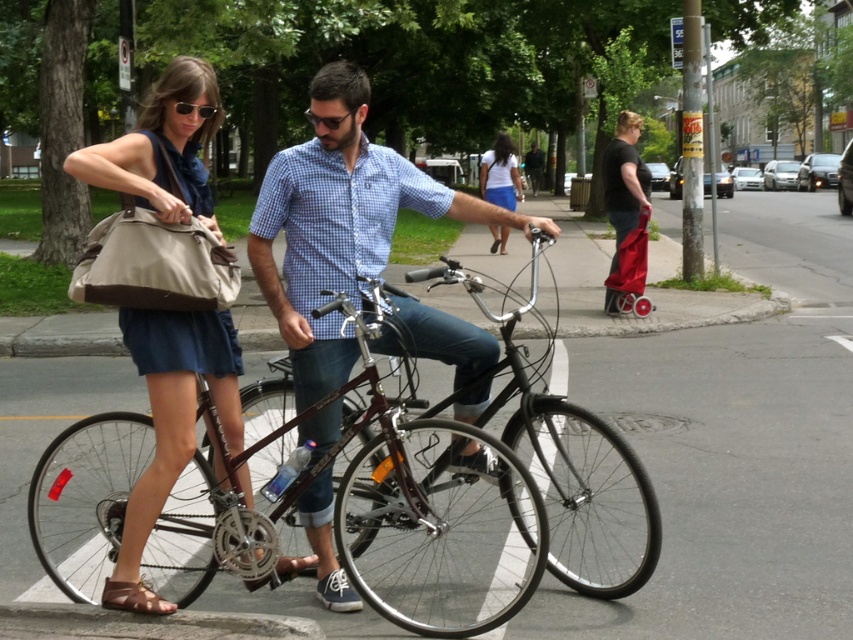
Question: Which object is farther from the camera taking this photo?

Choices:
 (A) matte blue shirt at center
 (B) shiny black bicycle at center
 (C) white cotton shirt at center
 (D) matte beige tote bag at left

Answer: (C)

Question: Does matte blue shirt at center come in front of white cotton shirt at center?

Choices:
 (A) no
 (B) yes

Answer: (B)

Question: Which point is farther to the camera?

Choices:
 (A) shiny black bicycle at center
 (B) white cotton shirt at center
 (C) matte blue shirt at center

Answer: (B)

Question: Can you confirm if matte blue shirt at center is positioned above white cotton shirt at center?

Choices:
 (A) yes
 (B) no

Answer: (B)

Question: Observing the image, what is the correct spatial positioning of matte beige tote bag at left in reference to white cotton shirt at center?

Choices:
 (A) below
 (B) above

Answer: (A)

Question: Which is nearer to the white cotton shirt at center?

Choices:
 (A) matte beige tote bag at left
 (B) matte blue shirt at center
 (C) shiny black bicycle at center

Answer: (C)